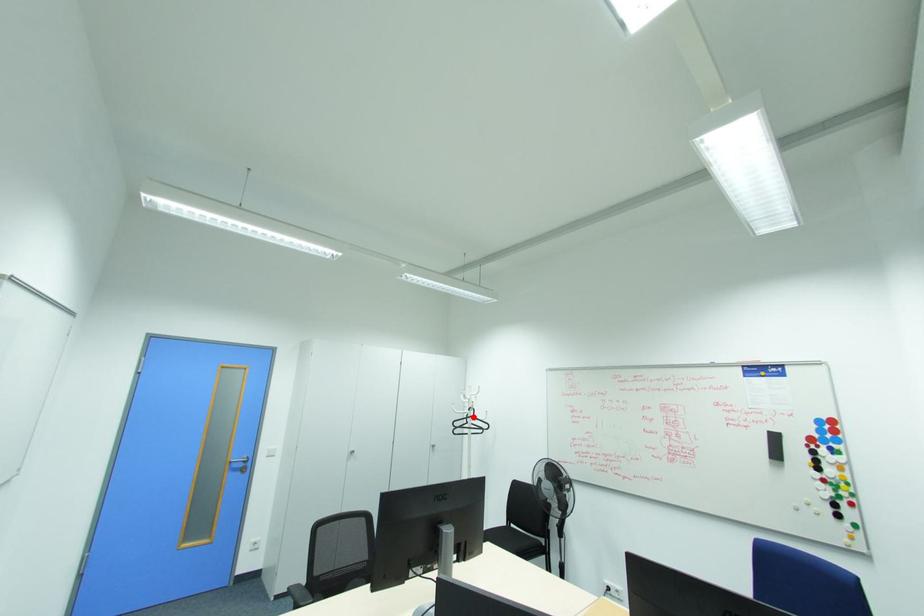
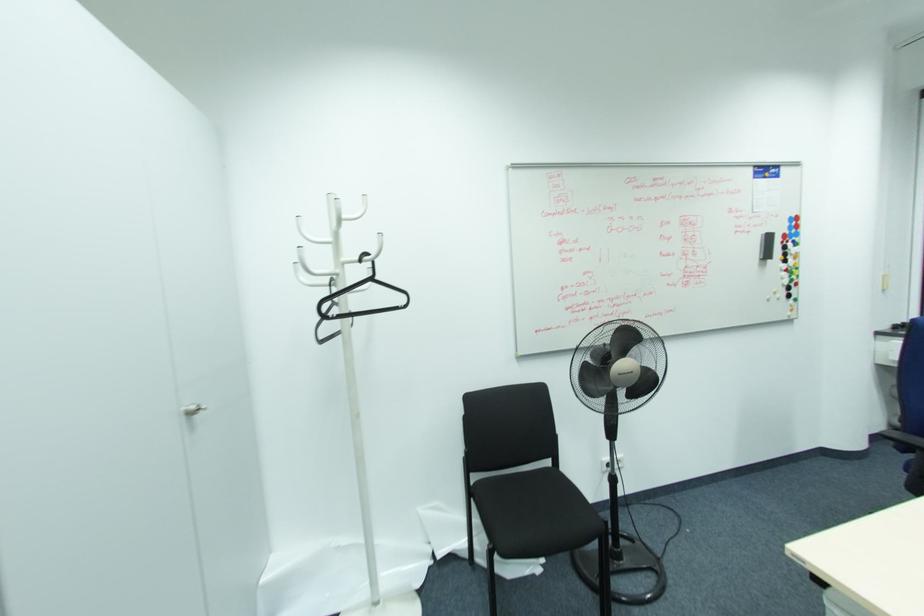
In the second image, find the point that corresponds to the highlighted location in the first image.

(371, 280)